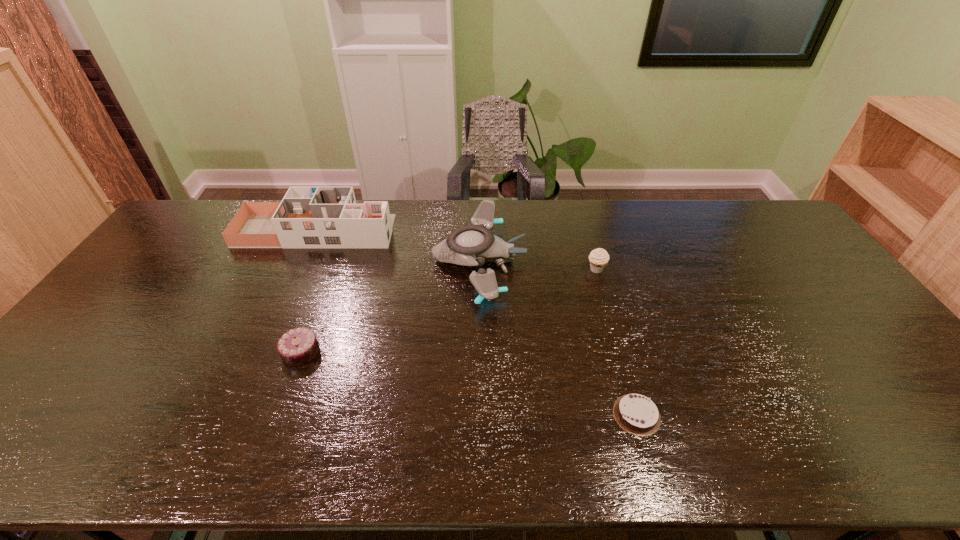
At what (x,y) coordinates should I click in order to perform the action: click on vacant area that satisfies the following two spatial constraints: 1. at the front door of the third tallest object; 2. on the left side of the tallest object. Please return your answer as a coordinate pair (x, y). Image resolution: width=960 pixels, height=540 pixels. Looking at the image, I should click on (299, 269).